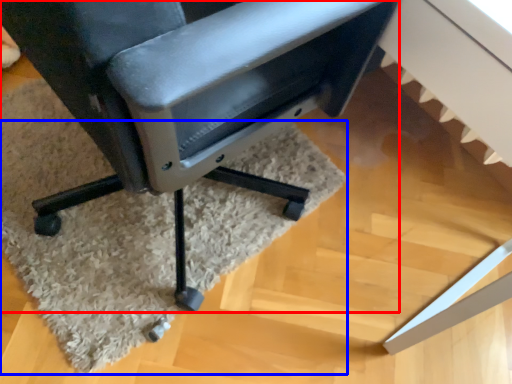
Question: Which of the following is the farthest to the observer, chair (highlighted by a red box) or mat (highlighted by a blue box)?

Choices:
 (A) chair
 (B) mat

Answer: (B)